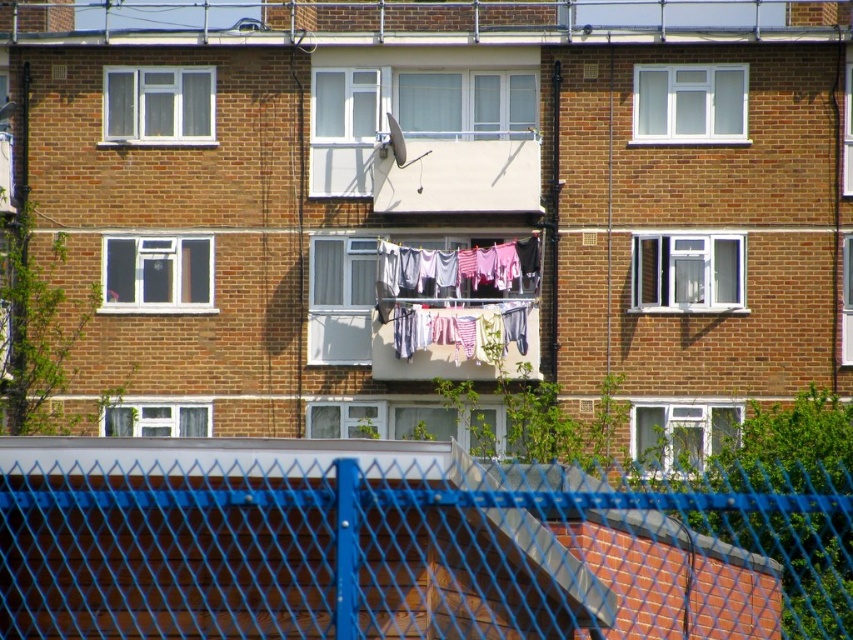
You are standing in front of the apartment building and want to know the exact location of the blue wire mesh fence at center. Can you tell me its coordinates?

The blue wire mesh fence at center is located at coordinates point (361, 545).